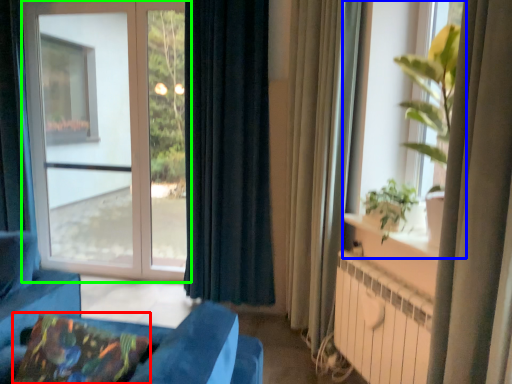
Question: Based on their relative distances, which object is nearer to pillow (highlighted by a red box)? Choose from window (highlighted by a blue box) and window (highlighted by a green box).

Choices:
 (A) window
 (B) window

Answer: (A)